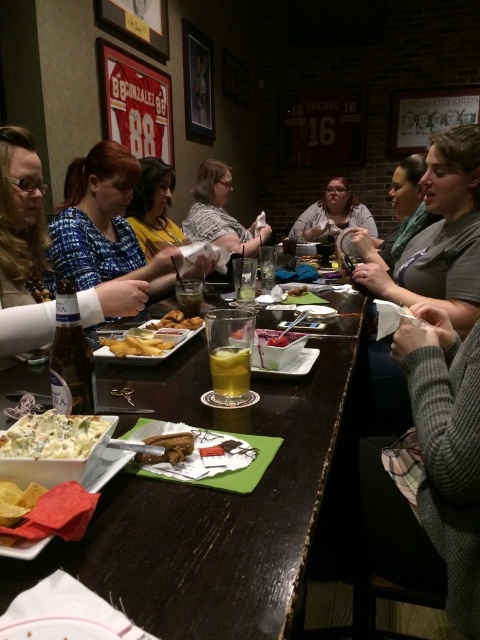
You are a server at the sports bar and need to place a large platter that requires 3 feet of space. You see the wooden table at center and the clear glass at center. Which surface can accommodate the platter?

The wooden table at center has a larger width than the clear glass at center, so the platter can be placed on the wooden table at center.

You are sitting at the wooden table at center and want to reach for the clear glass at center. Is the glass within easy reach from your current position?

The wooden table at center is closer to the viewer than clear glass at center, so the glass is farther away and may not be within easy reach from your current position.